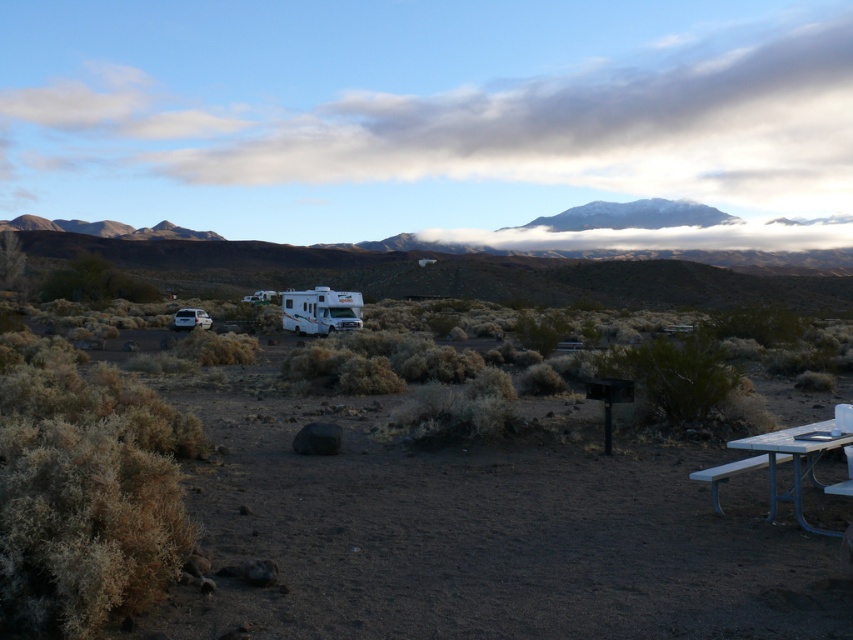
You are planning a picnic and need to set up a table. You have a white plastic picnic table at center and a white matte recreational vehicle at left. Which object can you use to place your picnic items?

The white plastic picnic table at center can be used to place your picnic items since it is designed for that purpose, while the white matte recreational vehicle at left is a vehicle and not suitable for placing items.

You are planning a picnic in the desert and see the snowy rock mountain at upper center and the white plastic picnic table at lower right. Which object is closer to you as you stand in the scene?

The snowy rock mountain at upper center is closer to you because the white plastic picnic table at lower right is behind it.

You are planning to set up a picnic in this desert area. You have two picnic tables available. Which one between the white plastic picnic table at center and the white plastic picnic table at lower right should you choose if you want the taller one for better visibility?

The white plastic picnic table at center is taller than the white plastic picnic table at lower right, so you should choose the white plastic picnic table at center for better visibility.